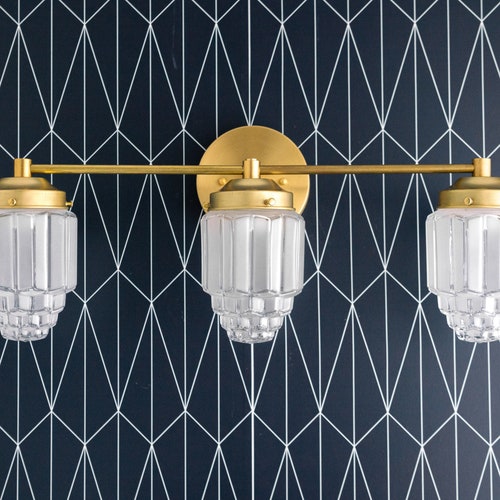
Locate an element on the screen. The width and height of the screenshot is (500, 500). wall pattern is located at coordinates (355, 305), (119, 269).